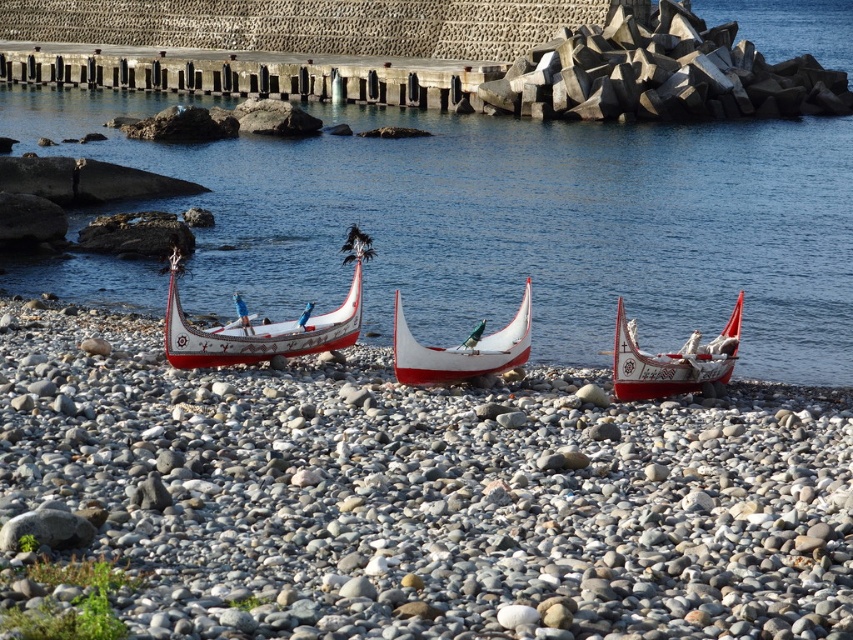
Question: Is concrete pier at upper center closer to the viewer compared to white glossy boat at center?

Choices:
 (A) yes
 (B) no

Answer: (B)

Question: Which of the following is the closest to the observer?

Choices:
 (A) transparent water at center
 (B) white painted wood boat at center
 (C) white glossy boat at center
 (D) white glossy canoe at center

Answer: (C)

Question: Which is nearer to the white glossy boat at center?

Choices:
 (A) transparent water at center
 (B) white painted wood boat at center
 (C) white glossy canoe at center

Answer: (C)

Question: Does transparent water at center appear under white glossy boat at center?

Choices:
 (A) no
 (B) yes

Answer: (A)

Question: Is concrete pier at upper center positioned at the back of white glossy boat at center?

Choices:
 (A) no
 (B) yes

Answer: (B)

Question: Estimate the real-world distances between objects in this image. Which object is closer to the white glossy boat at center?

Choices:
 (A) concrete pier at upper center
 (B) transparent water at center

Answer: (B)